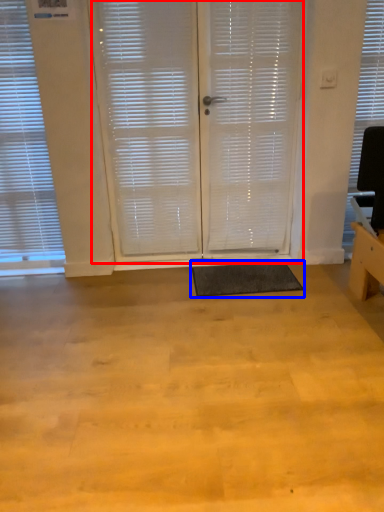
Question: Which object is further to the camera taking this photo, screen door (highlighted by a red box) or yoga mat (highlighted by a blue box)?

Choices:
 (A) screen door
 (B) yoga mat

Answer: (B)